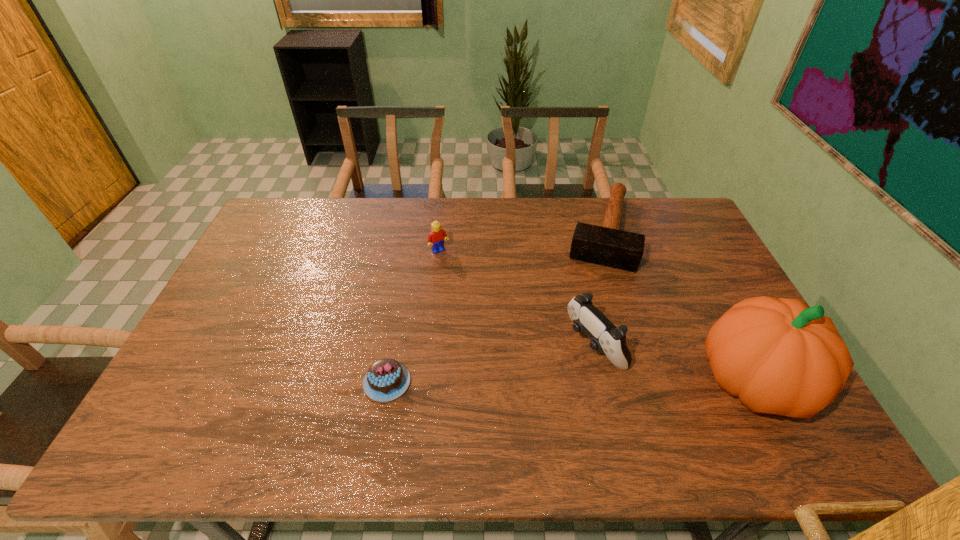
Locate an element on the screen. Image resolution: width=960 pixels, height=540 pixels. free space that is in between the control and the leftmost object is located at coordinates (491, 363).

Identify the location of free point between the control and the mallet. The image size is (960, 540). (597, 288).

Find the location of a particular element. free spot between the pumpkin and the shortest object is located at coordinates (570, 382).

The image size is (960, 540). What are the coordinates of `vacant area that lies between the mallet and the fourth object from right to left` in the screenshot? It's located at (519, 241).

Where is `free area in between the control and the third shortest object`? This screenshot has width=960, height=540. free area in between the control and the third shortest object is located at coordinates (516, 298).

At what (x,y) coordinates should I click in order to perform the action: click on free space that is in between the pumpkin and the mallet. Please return your answer as a coordinate pair (x, y). Looking at the image, I should click on (677, 307).

Where is `empty space that is in between the mallet and the third tallest object`? Image resolution: width=960 pixels, height=540 pixels. empty space that is in between the mallet and the third tallest object is located at coordinates (519, 241).

Locate which object ranks third in proximity to the shortest object. Please provide its 2D coordinates. Your answer should be formatted as a tuple, i.e. [(x, y)], where the tuple contains the x and y coordinates of a point satisfying the conditions above.

[(606, 245)]

Locate an element on the screen. The width and height of the screenshot is (960, 540). object that is the third closest to the tallest object is located at coordinates (386, 379).

Image resolution: width=960 pixels, height=540 pixels. I want to click on vacant space that satisfies the following two spatial constraints: 1. on the back side of the chocolate cake; 2. on the right side of the mallet, so (x=414, y=232).